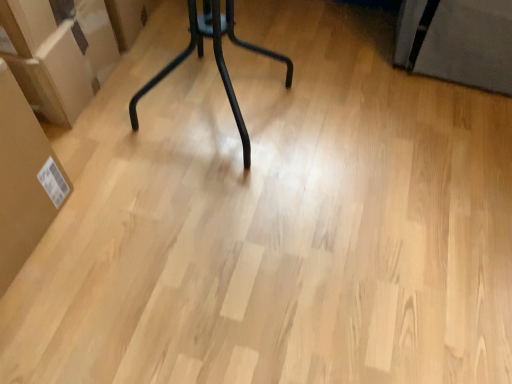
Find the location of a particular element. This screenshot has height=384, width=512. matte brown cardboard at left, arranged as the 1th cardboard box when viewed from the top is located at coordinates (58, 53).

What do you see at coordinates (58, 53) in the screenshot? I see `matte brown cardboard at left, placed as the 2th cardboard box when sorted from front to back` at bounding box center [58, 53].

Measure the distance between matte brown cardboard at left, which ranks as the 2th cardboard box in bottom-to-top order, and camera.

The depth of matte brown cardboard at left, which ranks as the 2th cardboard box in bottom-to-top order, is 3.66 feet.

This screenshot has width=512, height=384. Describe the element at coordinates (24, 179) in the screenshot. I see `brown cardboard box at left, arranged as the 2th cardboard box when viewed from the back` at that location.

Find the location of a particular element. brown cardboard box at left, which ranks as the 1th cardboard box in bottom-to-top order is located at coordinates (24, 179).

Find the location of a particular element. matte brown cardboard at left, which is counted as the 1th cardboard box, starting from the back is located at coordinates (58, 53).

Does brown cardboard box at left, which ranks as the 1th cardboard box in bottom-to-top order, appear on the left side of matte brown cardboard at left, which is counted as the 1th cardboard box, starting from the back?

Incorrect, brown cardboard box at left, which ranks as the 1th cardboard box in bottom-to-top order, is not on the left side of matte brown cardboard at left, which is counted as the 1th cardboard box, starting from the back.

Which object is closer to the camera taking this photo, brown cardboard box at left, which ranks as the 2th cardboard box in top-to-bottom order, or matte brown cardboard at left, placed as the 2th cardboard box when sorted from front to back?

brown cardboard box at left, which ranks as the 2th cardboard box in top-to-bottom order, is in front.

Considering the positions of points (37, 198) and (74, 13), is point (37, 198) closer to camera compared to point (74, 13)?

Yes, it is in front of point (74, 13).

From the image's perspective, which one is positioned lower, brown cardboard box at left, arranged as the 2th cardboard box when viewed from the back, or matte brown cardboard at left, arranged as the 1th cardboard box when viewed from the top?

brown cardboard box at left, arranged as the 2th cardboard box when viewed from the back, is shown below in the image.

From a real-world perspective, which is physically above, brown cardboard box at left, which ranks as the 2th cardboard box in top-to-bottom order, or matte brown cardboard at left, which ranks as the 2th cardboard box in bottom-to-top order?

brown cardboard box at left, which ranks as the 2th cardboard box in top-to-bottom order.

In the scene shown: Considering the sizes of objects brown cardboard box at left, which ranks as the 2th cardboard box in top-to-bottom order, and matte brown cardboard at left, which ranks as the 2th cardboard box in bottom-to-top order, in the image provided, who is wider, brown cardboard box at left, which ranks as the 2th cardboard box in top-to-bottom order, or matte brown cardboard at left, which ranks as the 2th cardboard box in bottom-to-top order,?

matte brown cardboard at left, which ranks as the 2th cardboard box in bottom-to-top order.

Who is shorter, brown cardboard box at left, arranged as the 2th cardboard box when viewed from the back, or matte brown cardboard at left, which ranks as the 2th cardboard box in bottom-to-top order?

With less height is matte brown cardboard at left, which ranks as the 2th cardboard box in bottom-to-top order.

Who is smaller, brown cardboard box at left, placed as the first cardboard box when sorted from front to back, or matte brown cardboard at left, placed as the 2th cardboard box when sorted from front to back?

Smaller between the two is brown cardboard box at left, placed as the first cardboard box when sorted from front to back.

Can matte brown cardboard at left, arranged as the 1th cardboard box when viewed from the top, be found inside brown cardboard box at left, which ranks as the 2th cardboard box in top-to-bottom order?

No, matte brown cardboard at left, arranged as the 1th cardboard box when viewed from the top, is not inside brown cardboard box at left, which ranks as the 2th cardboard box in top-to-bottom order.

Is brown cardboard box at left, placed as the first cardboard box when sorted from front to back, not near matte brown cardboard at left, which is counted as the 1th cardboard box, starting from the back?

brown cardboard box at left, placed as the first cardboard box when sorted from front to back, is near matte brown cardboard at left, which is counted as the 1th cardboard box, starting from the back, not far away.

Is brown cardboard box at left, arranged as the 2th cardboard box when viewed from the back, positioned with its back to matte brown cardboard at left, arranged as the 1th cardboard box when viewed from the top?

brown cardboard box at left, arranged as the 2th cardboard box when viewed from the back, is not turned away from matte brown cardboard at left, arranged as the 1th cardboard box when viewed from the top.

Can you tell me how much brown cardboard box at left, placed as the first cardboard box when sorted from front to back, and matte brown cardboard at left, placed as the 2th cardboard box when sorted from front to back, differ in facing direction?

The angle between the facing direction of brown cardboard box at left, placed as the first cardboard box when sorted from front to back, and the facing direction of matte brown cardboard at left, placed as the 2th cardboard box when sorted from front to back, is 0.00214 degrees.

At what (x,y) coordinates should I click in order to perform the action: click on cardboard box below the brown cardboard box at left, which ranks as the 1th cardboard box in bottom-to-top order (from a real-world perspective). Please return your answer as a coordinate pair (x, y). The image size is (512, 384). Looking at the image, I should click on (58, 53).

Based on their positions, is matte brown cardboard at left, placed as the 2th cardboard box when sorted from front to back, located to the left or right of brown cardboard box at left, which ranks as the 1th cardboard box in bottom-to-top order?

matte brown cardboard at left, placed as the 2th cardboard box when sorted from front to back, is positioned on brown cardboard box at left, which ranks as the 1th cardboard box in bottom-to-top order,'s left side.

Does matte brown cardboard at left, placed as the 2th cardboard box when sorted from front to back, come in front of brown cardboard box at left, which ranks as the 2th cardboard box in top-to-bottom order?

That is False.

Which is less distant, (110, 38) or (14, 198)?

Point (14, 198)

From the image's perspective, between matte brown cardboard at left, which ranks as the 2th cardboard box in bottom-to-top order, and brown cardboard box at left, which ranks as the 2th cardboard box in top-to-bottom order, who is located below?

brown cardboard box at left, which ranks as the 2th cardboard box in top-to-bottom order, from the image's perspective.

From a real-world perspective, is matte brown cardboard at left, arranged as the 1th cardboard box when viewed from the top, above or below brown cardboard box at left, which ranks as the 1th cardboard box in bottom-to-top order?

From a real-world perspective, matte brown cardboard at left, arranged as the 1th cardboard box when viewed from the top, is physically below brown cardboard box at left, which ranks as the 1th cardboard box in bottom-to-top order.

Considering the relative sizes of matte brown cardboard at left, which ranks as the 2th cardboard box in bottom-to-top order, and brown cardboard box at left, which ranks as the 1th cardboard box in bottom-to-top order, in the image provided, is matte brown cardboard at left, which ranks as the 2th cardboard box in bottom-to-top order, thinner than brown cardboard box at left, which ranks as the 1th cardboard box in bottom-to-top order,?

No.

Which of these two, matte brown cardboard at left, arranged as the 1th cardboard box when viewed from the top, or brown cardboard box at left, which ranks as the 1th cardboard box in bottom-to-top order, stands taller?

brown cardboard box at left, which ranks as the 1th cardboard box in bottom-to-top order.

Which of these two, matte brown cardboard at left, placed as the 2th cardboard box when sorted from front to back, or brown cardboard box at left, which ranks as the 2th cardboard box in top-to-bottom order, is bigger?

Bigger between the two is matte brown cardboard at left, placed as the 2th cardboard box when sorted from front to back.

Is brown cardboard box at left, arranged as the 2th cardboard box when viewed from the back, located within matte brown cardboard at left, placed as the 2th cardboard box when sorted from front to back?

That's incorrect, brown cardboard box at left, arranged as the 2th cardboard box when viewed from the back, is not inside matte brown cardboard at left, placed as the 2th cardboard box when sorted from front to back.

Is matte brown cardboard at left, which ranks as the 2th cardboard box in bottom-to-top order, directly adjacent to brown cardboard box at left, which ranks as the 1th cardboard box in bottom-to-top order?

matte brown cardboard at left, which ranks as the 2th cardboard box in bottom-to-top order, is not next to brown cardboard box at left, which ranks as the 1th cardboard box in bottom-to-top order, and they're not touching.

Is matte brown cardboard at left, placed as the 2th cardboard box when sorted from front to back, positioned with its back to brown cardboard box at left, which ranks as the 1th cardboard box in bottom-to-top order?

matte brown cardboard at left, placed as the 2th cardboard box when sorted from front to back, is not turned away from brown cardboard box at left, which ranks as the 1th cardboard box in bottom-to-top order.

What's the angular difference between matte brown cardboard at left, arranged as the 1th cardboard box when viewed from the top, and brown cardboard box at left, which ranks as the 1th cardboard box in bottom-to-top order,'s facing directions?

The facing directions of matte brown cardboard at left, arranged as the 1th cardboard box when viewed from the top, and brown cardboard box at left, which ranks as the 1th cardboard box in bottom-to-top order, are 0.00214 degrees apart.

Could you measure the distance between matte brown cardboard at left, which is counted as the 1th cardboard box, starting from the back, and brown cardboard box at left, placed as the first cardboard box when sorted from front to back?

matte brown cardboard at left, which is counted as the 1th cardboard box, starting from the back, is 13.41 inches from brown cardboard box at left, placed as the first cardboard box when sorted from front to back.

This screenshot has width=512, height=384. Find the location of `cardboard box below the matte brown cardboard at left, arranged as the 1th cardboard box when viewed from the top (from the image's perspective)`. cardboard box below the matte brown cardboard at left, arranged as the 1th cardboard box when viewed from the top (from the image's perspective) is located at coordinates (24, 179).

The width and height of the screenshot is (512, 384). I want to click on cardboard box below the brown cardboard box at left, which ranks as the 2th cardboard box in top-to-bottom order (from a real-world perspective), so click(x=58, y=53).

Locate an element on the screen. cardboard box on the left of brown cardboard box at left, placed as the first cardboard box when sorted from front to back is located at coordinates (58, 53).